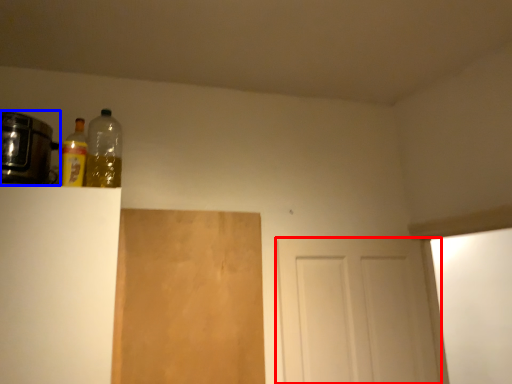
Question: Which of the following is the farthest to the observer, door (highlighted by a red box) or appliance (highlighted by a blue box)?

Choices:
 (A) door
 (B) appliance

Answer: (A)